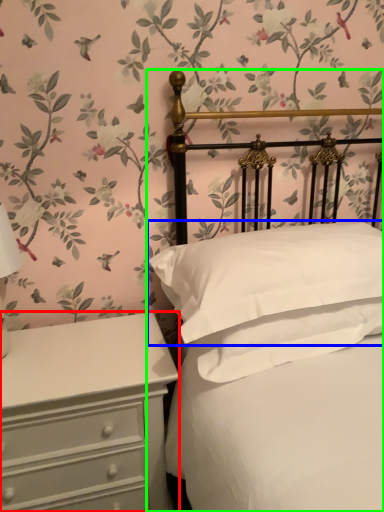
Question: Which object is the farthest from chest of drawers (highlighted by a red box)? Choose among these: pillow (highlighted by a blue box) or bed (highlighted by a green box).

Choices:
 (A) pillow
 (B) bed

Answer: (B)